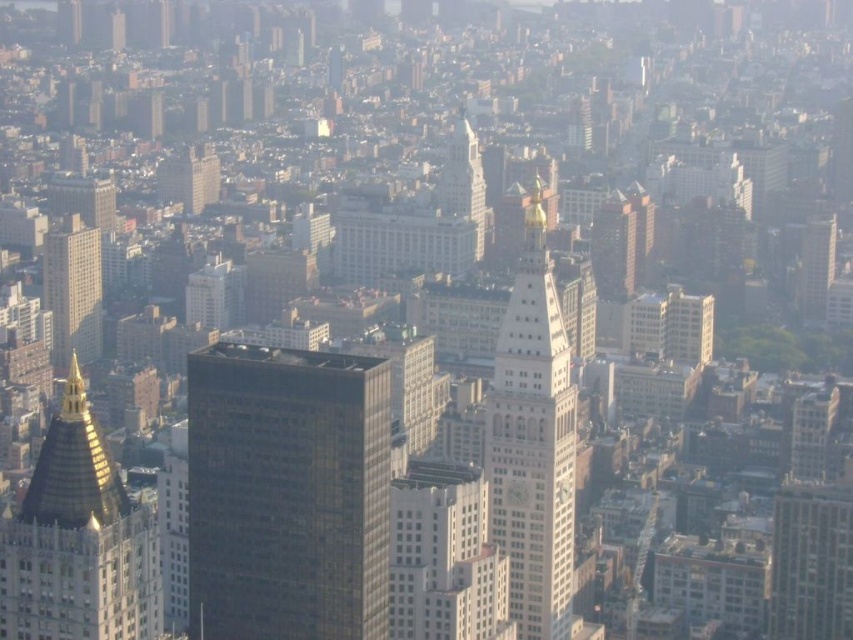
Question: Is gold metallic dome at left thinner than gold-tipped stone clock tower at center?

Choices:
 (A) no
 (B) yes

Answer: (A)

Question: Based on their relative distances, which object is farther from the gold metallic dome at left?

Choices:
 (A) white matte building at upper center
 (B) white stone tower at center
 (C) black glass building at center
 (D) gold-tipped stone clock tower at center

Answer: (B)

Question: Which of these objects is positioned closest to the matte gray skyscraper at left?

Choices:
 (A) white stone tower at center
 (B) black glass building at center

Answer: (B)

Question: Is gold-tipped stone clock tower at center thinner than white matte building at upper center?

Choices:
 (A) yes
 (B) no

Answer: (B)

Question: Is black glass building at center wider than gold metallic dome at left?

Choices:
 (A) yes
 (B) no

Answer: (A)

Question: Which object is the closest to the black glass building at center?

Choices:
 (A) matte gray skyscraper at left
 (B) white matte building at upper center
 (C) white stone tower at center

Answer: (B)